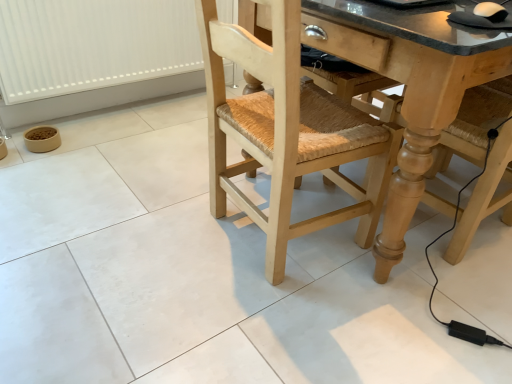
Identify the location of free region under white plastic radiator at lower left (from a real-world perspective). (106, 112).